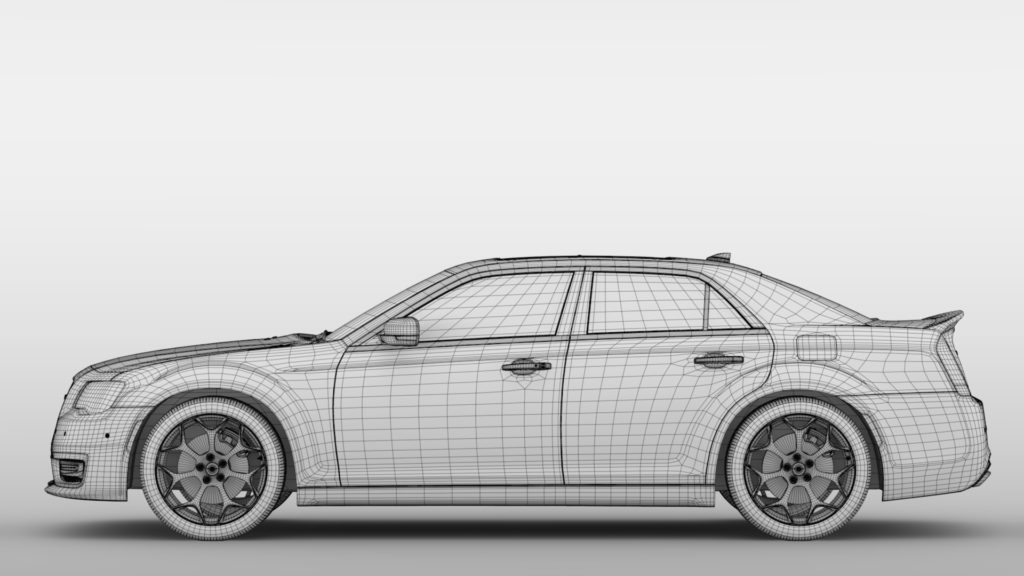
This screenshot has width=1024, height=576. Identify the location of handle. (527, 370).